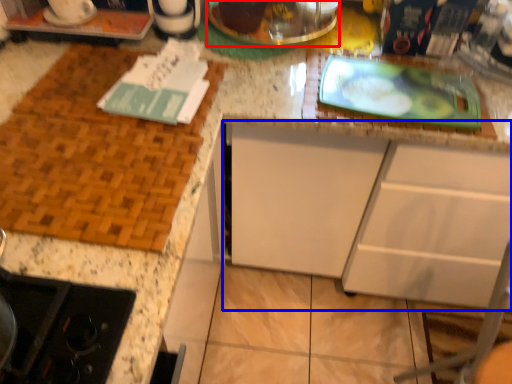
Question: Which of the following is the closest to the observer, appliance (highlighted by a red box) or cabinetry (highlighted by a blue box)?

Choices:
 (A) appliance
 (B) cabinetry

Answer: (B)